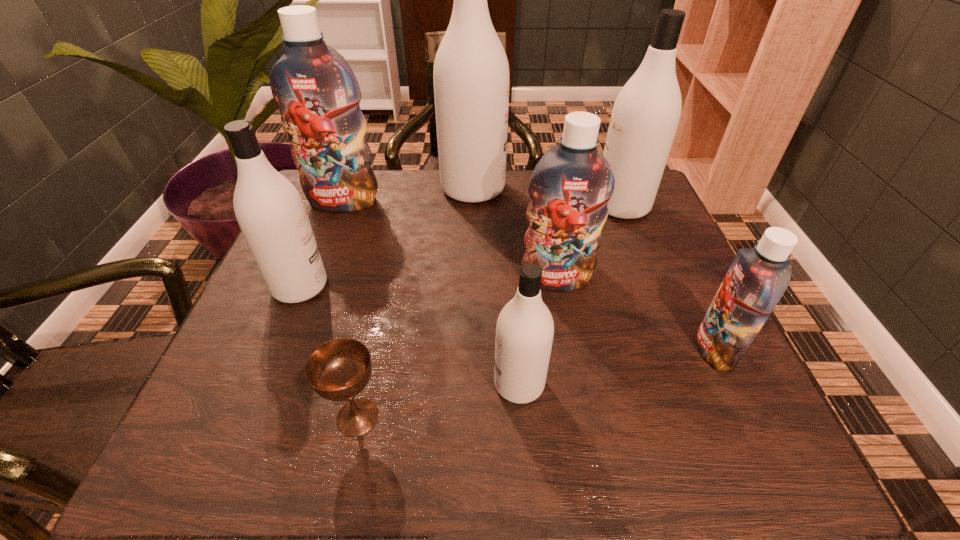
Find the location of `the smallest blue shampoo`. the smallest blue shampoo is located at coordinates (757, 278).

The width and height of the screenshot is (960, 540). I want to click on the smallest white shampoo, so click(524, 334).

Where is `the third object from left to right`? This screenshot has height=540, width=960. the third object from left to right is located at coordinates (338, 370).

The width and height of the screenshot is (960, 540). In order to click on the shortest object in this screenshot , I will do `click(338, 370)`.

This screenshot has height=540, width=960. In order to click on free location located on the front-facing side of the tallest shampoo in this screenshot , I will do `click(618, 188)`.

Where is `free space located on the front-facing side of the rightmost white shampoo`? This screenshot has height=540, width=960. free space located on the front-facing side of the rightmost white shampoo is located at coordinates click(528, 206).

Locate an element on the screen. The image size is (960, 540). blank space located on the front-facing side of the rightmost white shampoo is located at coordinates (528, 206).

Where is `free point located on the front-facing side of the rightmost white shampoo`? The width and height of the screenshot is (960, 540). free point located on the front-facing side of the rightmost white shampoo is located at coordinates (574, 206).

Where is `vacant area situated on the front label of the farthest blue shampoo`? This screenshot has width=960, height=540. vacant area situated on the front label of the farthest blue shampoo is located at coordinates (301, 312).

Where is `vacant space located 0.130m on the front-facing side of the third farthest white shampoo`? vacant space located 0.130m on the front-facing side of the third farthest white shampoo is located at coordinates (389, 287).